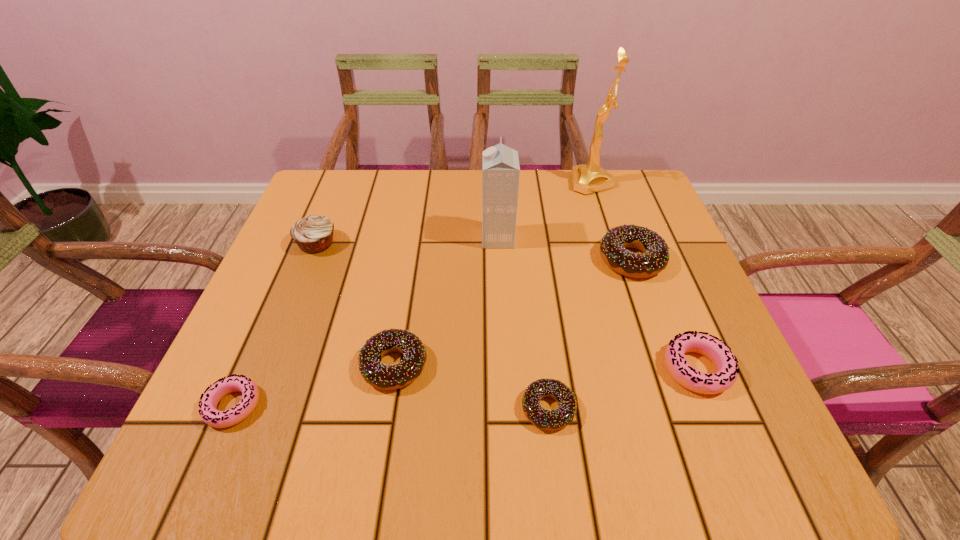
At what (x,y) coordinates should I click in order to perform the action: click on free space located on the front of the fourth tallest object. Please return your answer as a coordinate pair (x, y). The height and width of the screenshot is (540, 960). Looking at the image, I should click on (649, 308).

Where is `free space located 0.100m on the back of the leftmost chocolate doughnut`? This screenshot has width=960, height=540. free space located 0.100m on the back of the leftmost chocolate doughnut is located at coordinates (405, 299).

Where is `free space located on the front of the right pink doughnut`? The image size is (960, 540). free space located on the front of the right pink doughnut is located at coordinates (732, 457).

I want to click on free region located 0.390m on the back of the third doughnut from left to right, so click(528, 240).

Identify the location of free space located on the back of the left pink doughnut. tap(274, 313).

Image resolution: width=960 pixels, height=540 pixels. Identify the location of object situated at the far edge. (589, 178).

Image resolution: width=960 pixels, height=540 pixels. What are the coordinates of `muffin located in the left edge section of the desktop` in the screenshot? It's located at (313, 234).

Locate an element on the screen. The image size is (960, 540). doughnut located at the left edge is located at coordinates (208, 411).

This screenshot has width=960, height=540. Identify the location of award located in the right edge section of the desktop. (589, 178).

Locate an element on the screen. The height and width of the screenshot is (540, 960). object located in the near left corner section of the desktop is located at coordinates (208, 411).